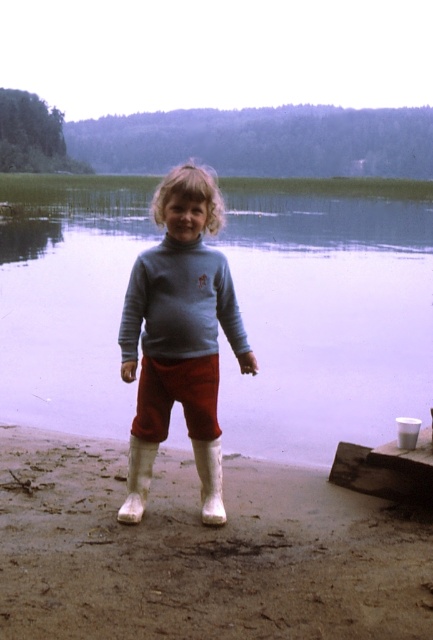
Question: Which point appears farthest from the camera in this image?

Choices:
 (A) (354, 225)
 (B) (199, 604)
 (C) (151, 435)
 (D) (131, 440)

Answer: (A)

Question: Is matte blue sweater at center smaller than red corduroy shorts at center?

Choices:
 (A) no
 (B) yes

Answer: (B)

Question: Among these objects, which one is farthest from the camera?

Choices:
 (A) brown sandy beach at lower center
 (B) red corduroy shorts at center

Answer: (B)

Question: Is smooth water at center smaller than matte blue sweater at center?

Choices:
 (A) no
 (B) yes

Answer: (A)

Question: Among these objects, which one is farthest from the camera?

Choices:
 (A) brown sandy beach at lower center
 (B) red corduroy shorts at center
 (C) matte blue sweater at center
 (D) smooth water at center

Answer: (D)

Question: Is smooth water at center to the right of brown sandy beach at lower center from the viewer's perspective?

Choices:
 (A) no
 (B) yes

Answer: (A)